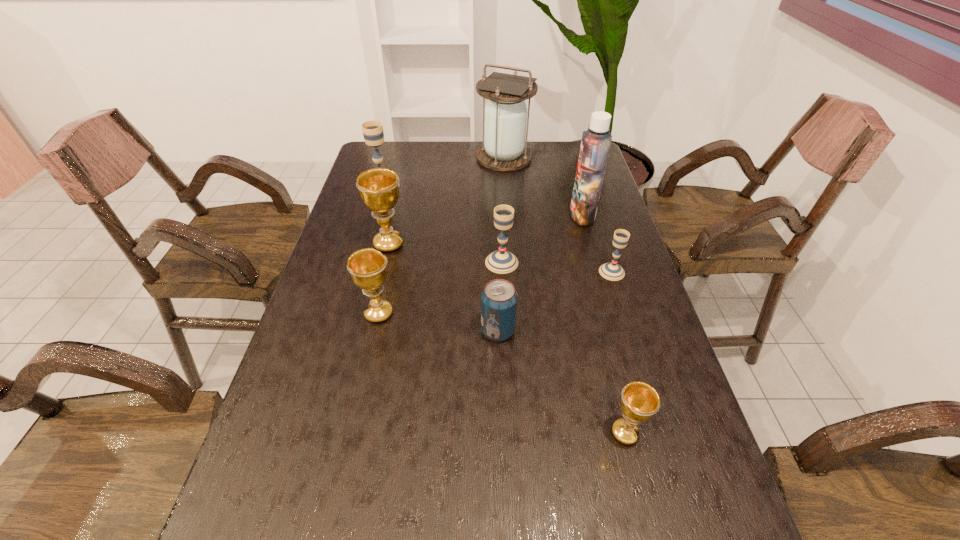
Find the location of a particular element. Image resolution: width=960 pixels, height=540 pixels. lantern is located at coordinates (504, 133).

I want to click on blue shampoo, so click(595, 145).

The width and height of the screenshot is (960, 540). Find the location of `shampoo`. shampoo is located at coordinates (595, 145).

Locate an element on the screen. The height and width of the screenshot is (540, 960). the biggest gold chalice is located at coordinates (379, 190).

I want to click on the leftmost gray chalice, so click(372, 130).

At what (x,y) coordinates should I click in order to perform the action: click on the second farthest object. Please return your answer as a coordinate pair (x, y). Looking at the image, I should click on (372, 130).

Identify the location of the second gray chalice from left to right. Image resolution: width=960 pixels, height=540 pixels. (501, 261).

This screenshot has width=960, height=540. Identify the location of the fourth chalice from left to right. (501, 261).

Where is `the second smallest gold chalice`? the second smallest gold chalice is located at coordinates 368,268.

Locate an element on the screen. Image resolution: width=960 pixels, height=540 pixels. the fifth farthest chalice is located at coordinates (x=368, y=268).